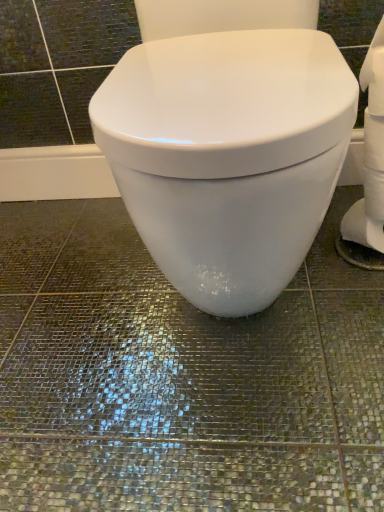
Question: Should I look upward or downward to see white matte toilet paper at right?

Choices:
 (A) down
 (B) up

Answer: (B)

Question: Is white matte toilet paper at right outside of white glossy toilet at center?

Choices:
 (A) no
 (B) yes

Answer: (B)

Question: Is white matte toilet paper at right facing towards white glossy toilet at center?

Choices:
 (A) no
 (B) yes

Answer: (B)

Question: Does white matte toilet paper at right touch white glossy toilet at center?

Choices:
 (A) no
 (B) yes

Answer: (A)

Question: Is white matte toilet paper at right shorter than white glossy toilet at center?

Choices:
 (A) yes
 (B) no

Answer: (A)

Question: From a real-world perspective, does white matte toilet paper at right sit lower than white glossy toilet at center?

Choices:
 (A) no
 (B) yes

Answer: (B)

Question: Considering the relative sizes of white matte toilet paper at right and white glossy toilet at center in the image provided, is white matte toilet paper at right taller than white glossy toilet at center?

Choices:
 (A) yes
 (B) no

Answer: (B)

Question: From the image's perspective, is white glossy toilet at center located beneath white matte toilet paper at right?

Choices:
 (A) yes
 (B) no

Answer: (B)

Question: Is white glossy toilet at center positioned before white matte toilet paper at right?

Choices:
 (A) yes
 (B) no

Answer: (A)

Question: Is white glossy toilet at center smaller than white matte toilet paper at right?

Choices:
 (A) no
 (B) yes

Answer: (A)

Question: Could white matte toilet paper at right be considered to be inside white glossy toilet at center?

Choices:
 (A) no
 (B) yes

Answer: (A)

Question: Is white glossy toilet at center far from white matte toilet paper at right?

Choices:
 (A) no
 (B) yes

Answer: (A)

Question: Is the surface of white glossy toilet at center in direct contact with white matte toilet paper at right?

Choices:
 (A) yes
 (B) no

Answer: (B)

Question: From the image's perspective, is white glossy toilet at center above or below white matte toilet paper at right?

Choices:
 (A) below
 (B) above

Answer: (B)